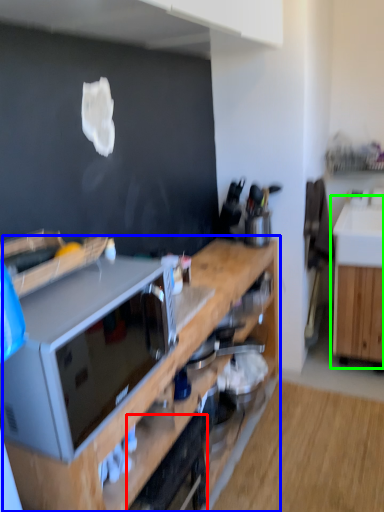
Question: Estimate the real-world distances between objects in this image. Which object is closer to appliance (highlighted by a red box), cabinetry (highlighted by a blue box) or cabinetry (highlighted by a green box)?

Choices:
 (A) cabinetry
 (B) cabinetry

Answer: (A)